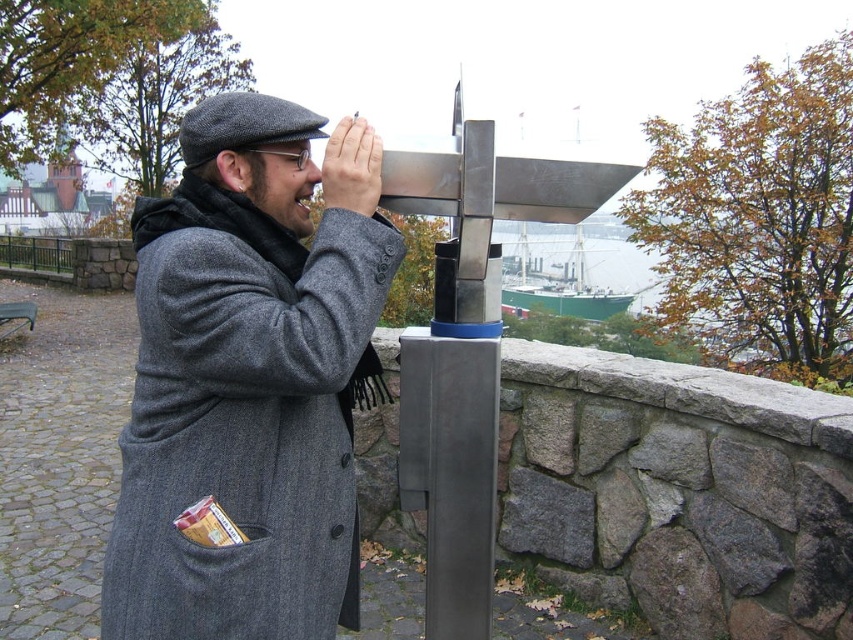
Consider the image. You are a fashion designer observing a person wearing a gray wool coat at center and a matte gray nose at center. Which clothing item is located lower on the person?

The gray wool coat at center is positioned under the matte gray nose at center, so the gray wool coat at center is lower.

You are a fashion designer observing the person in the image. You need to determine if the gray wool coat at center can be worn by someone with a matte gray nose at center. Is the coat wide enough to accommodate the nose?

The gray wool coat at center might be wider than matte gray nose at center, so it is possible that the coat can accommodate the nose.

What are the coordinates of the gray wool coat at center in the image?

The gray wool coat at center is located at coordinates point (250, 380).